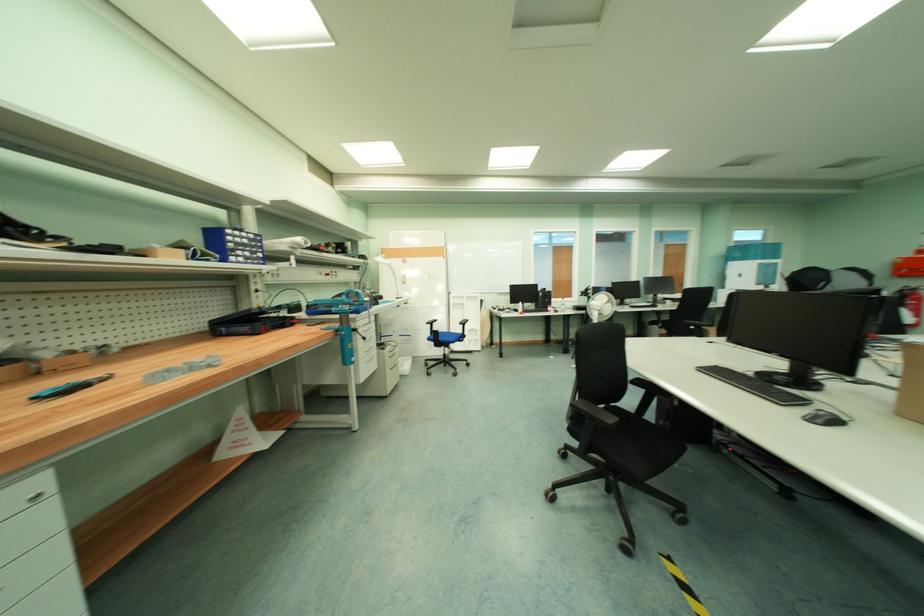
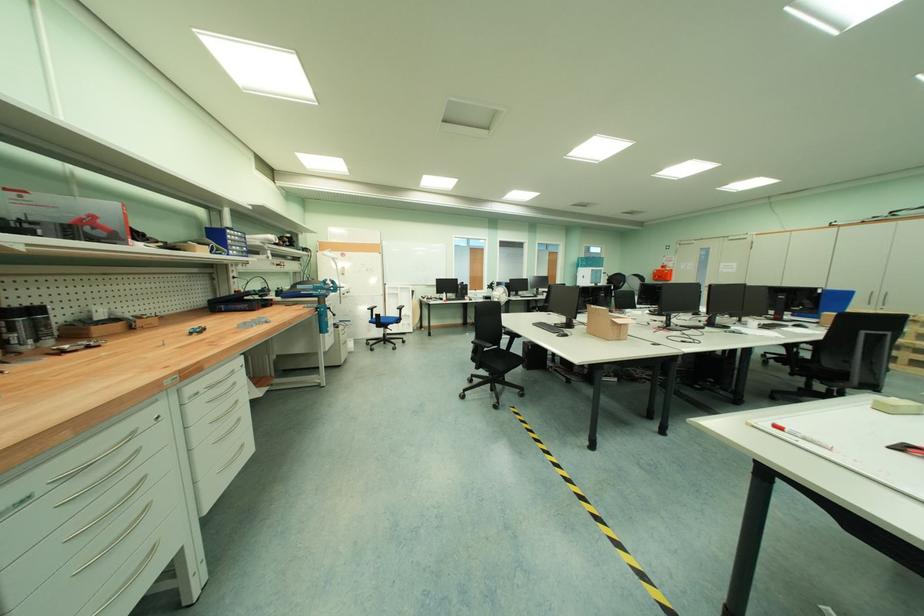
Question: The images are taken continuously from a first-person perspective. In which direction are you moving?

Choices:
 (A) Left
 (B) Right
 (C) Forward
 (D) Backward

Answer: (D)